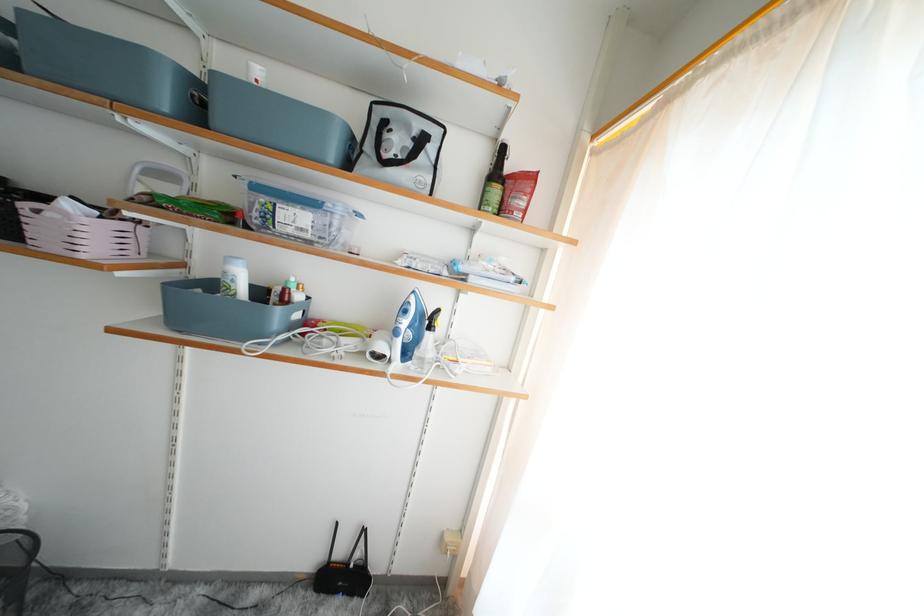
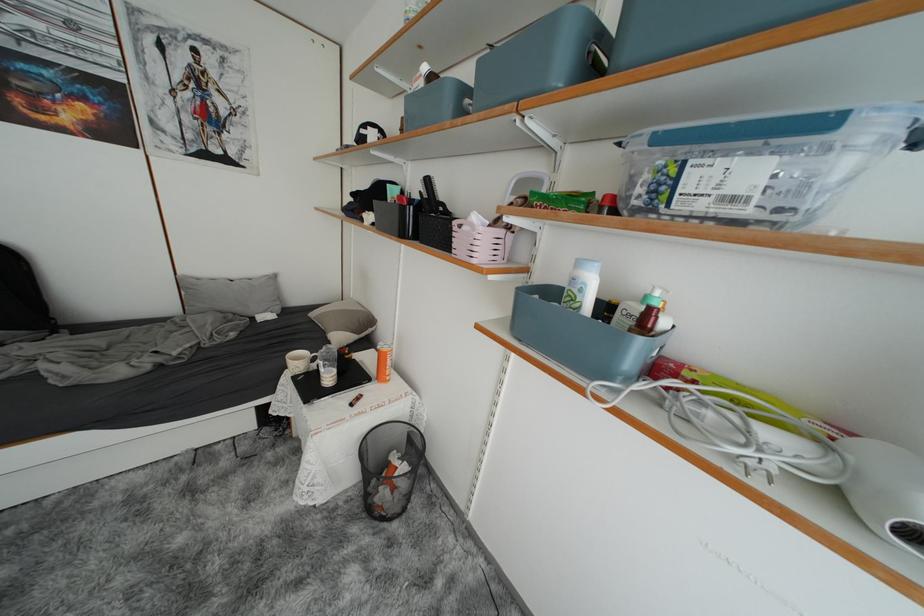
In the second image, find the point that corresponds to [292,294] in the first image.

(657, 315)